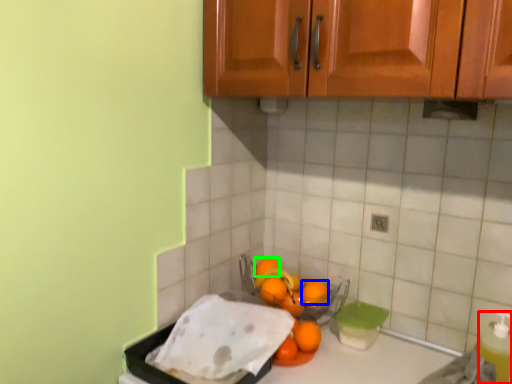
Question: Based on their relative distances, which object is nearer to bottle (highlighted by a red box)? Choose from orange (highlighted by a blue box) and orange (highlighted by a green box).

Choices:
 (A) orange
 (B) orange

Answer: (A)